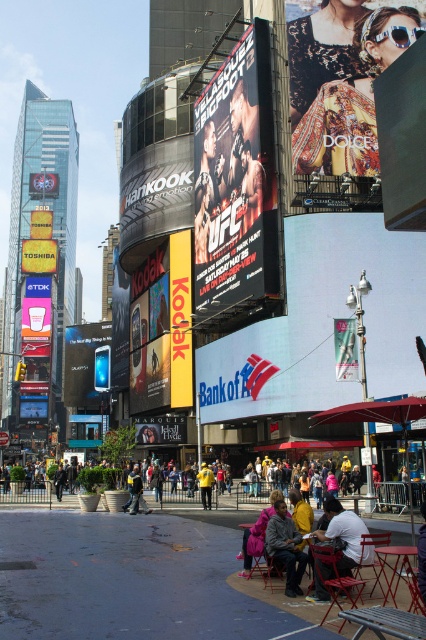
You are a city planner analyzing the space in front of the matte black sign at center and the metallic silver stool at lower center. If you need to place a new bench that is 1.2 meters wide, can both objects accommodate the bench between them without overlapping?

The matte black sign at center is wider than the metallic silver stool at lower center. Since the bench is 1.2 meters wide, the total space between them must be at least 1.2 meters. However, the exact distance isn not provided, so we cannot confirm if the bench will fit without overlapping.

You are a photographer standing in the foreground of the scene, wanting to take a photo of the yellow plastic billboard at center without the yellow cardboard kodak sign at center blocking it. What should you do?

The yellow cardboard kodak sign at center is in front of the yellow plastic billboard at center, so you should move to a position where the yellow cardboard kodak sign at center is no longer blocking your view of the yellow plastic billboard at center.

You are standing in Times Square and want to take a photo of both the matte black sign at center and the yellow plastic billboard at center. Which object should you position to your left side to include both in the frame?

To include both the matte black sign at center and the yellow plastic billboard at center in your photo, position the yellow plastic billboard at center to your left side since the matte black sign at center is to the right of it.